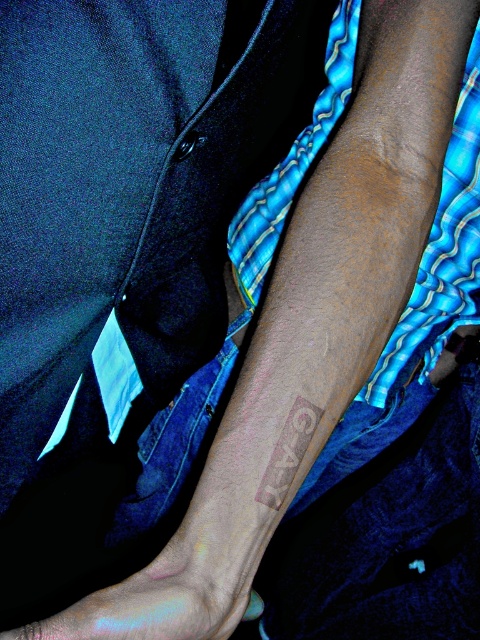
Question: Considering the relative positions of gray matte tattoo at lower center and smooth skin tattoo at lower left in the image provided, where is gray matte tattoo at lower center located with respect to smooth skin tattoo at lower left?

Choices:
 (A) above
 (B) below

Answer: (A)

Question: Where is gray matte tattoo at lower center located in relation to smooth skin tattoo at lower left in the image?

Choices:
 (A) below
 (B) above

Answer: (B)

Question: Is gray matte tattoo at lower center smaller than smooth skin tattoo at lower left?

Choices:
 (A) yes
 (B) no

Answer: (A)

Question: Which object is closer to the camera taking this photo?

Choices:
 (A) gray matte tattoo at lower center
 (B) smooth skin tattoo at lower left

Answer: (B)

Question: Which object is closer to the camera taking this photo?

Choices:
 (A) gray matte tattoo at lower center
 (B) smooth skin tattoo at lower left

Answer: (B)